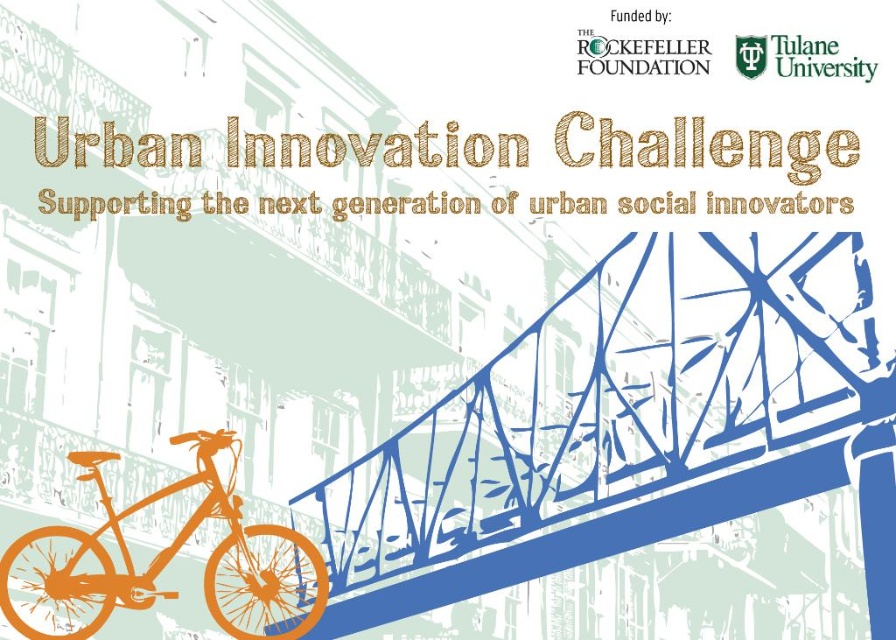
You are a city planner reviewing the Urban Innovation Challenge graphic. You need to determine the spatial relationship between the blue steel pedestrian bridge at center and the orange matte bicycle at lower left. Which object is located above the other?

The blue steel pedestrian bridge at center is positioned over orange matte bicycle at lower left, meaning the bridge is above the bicycle.

You are an urban planner designing a new city layout. You need to place the blue steel pedestrian bridge at center and the orange matte bicycle at lower left in a way that maintains their relative sizes as shown in the image. Which object should be placed closer to the foreground to achieve this?

The orange matte bicycle at lower left should be placed closer to the foreground because the blue steel pedestrian bridge at center is larger in size, so placing the smaller bicycle in the foreground maintains their relative sizes as shown in the image.